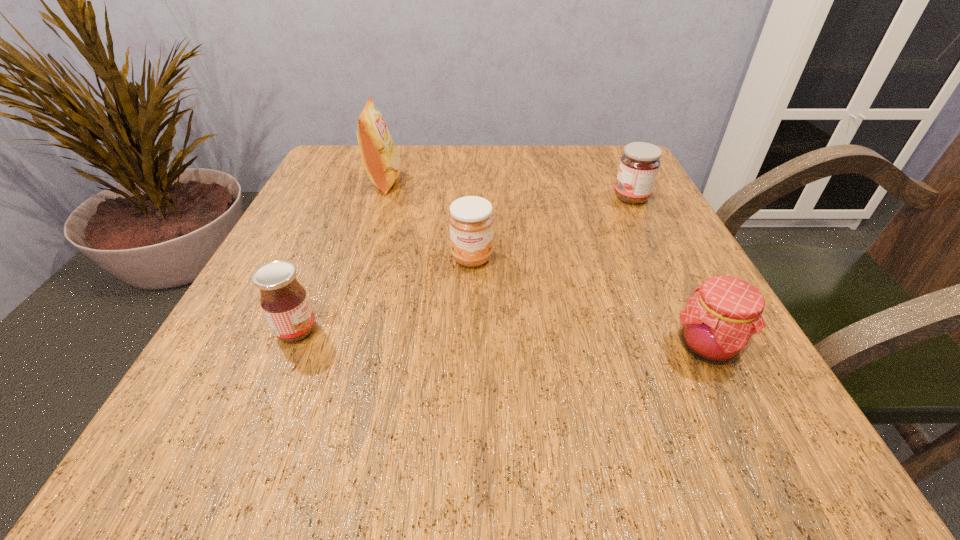
Locate an element on the screen. The image size is (960, 540). free region that satisfies the following two spatial constraints: 1. on the front label of the third nearest object; 2. on the label side of the leftmost jam is located at coordinates (470, 330).